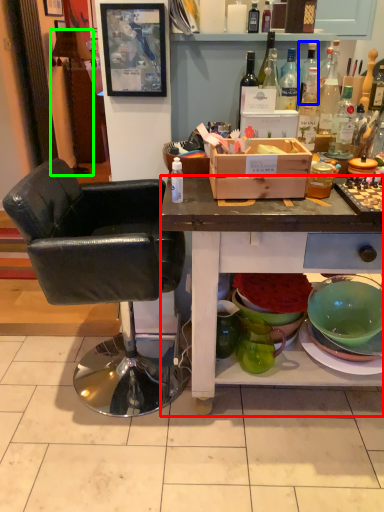
Question: Considering the real-world distances, which object is farthest from desk (highlighted by a red box)? bottle (highlighted by a blue box) or lamp (highlighted by a green box)?

Choices:
 (A) bottle
 (B) lamp

Answer: (B)